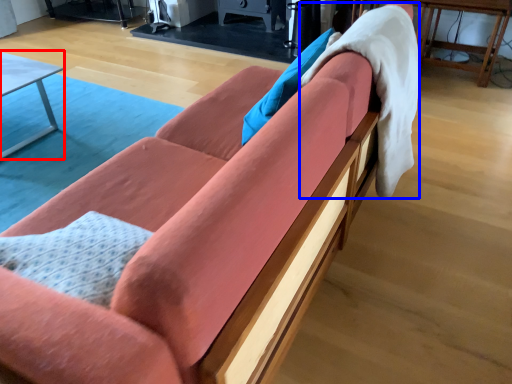
Question: Which object is further to the camera taking this photo, table (highlighted by a red box) or blanket (highlighted by a blue box)?

Choices:
 (A) table
 (B) blanket

Answer: (A)